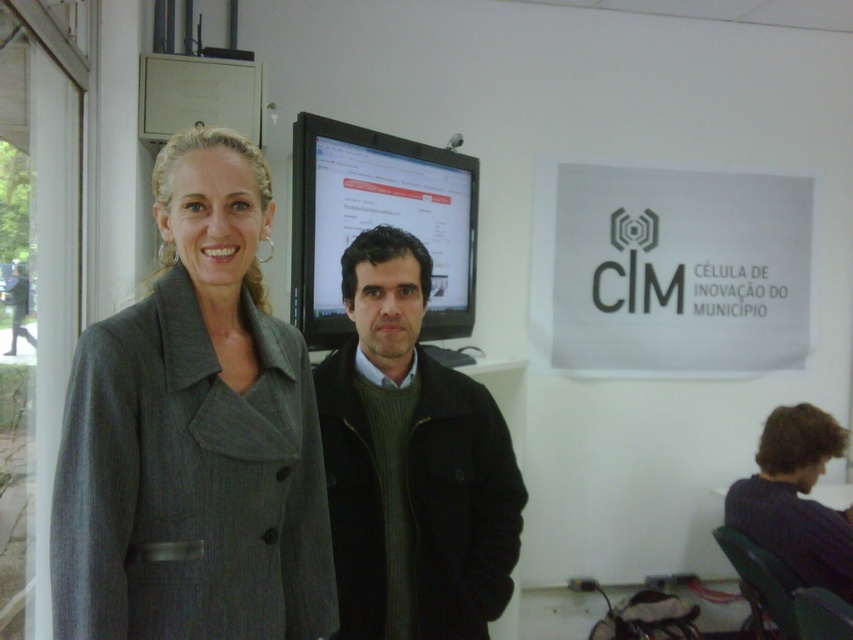
Between gray woolen coat at center and matte black monitor at center, which one appears on the left side from the viewer's perspective?

gray woolen coat at center is more to the left.

Between gray woolen coat at center and matte black monitor at center, which one is positioned lower?

gray woolen coat at center is below.

Who is more forward, (x=195, y=209) or (x=291, y=156)?

Point (x=195, y=209) is more forward.

The image size is (853, 640). Find the location of `gray woolen coat at center`. gray woolen coat at center is located at coordinates (194, 435).

Can you confirm if dark green sweater at center is wider than matte black monitor at center?

Incorrect, dark green sweater at center's width does not surpass matte black monitor at center's.

How far apart are dark green sweater at center and matte black monitor at center?

The distance of dark green sweater at center from matte black monitor at center is 31.81 inches.

Which is behind, point (390, 548) or point (463, 186)?

The point (463, 186) is more distant.

At what (x,y) coordinates should I click in order to perform the action: click on dark green sweater at center. Please return your answer as a coordinate pair (x, y). This screenshot has width=853, height=640. Looking at the image, I should click on (410, 464).

In the scene shown: Between gray woolen coat at center and dark green sweater at center, which one appears on the right side from the viewer's perspective?

From the viewer's perspective, dark green sweater at center appears more on the right side.

Is gray woolen coat at center in front of dark green sweater at center?

Yes.

The height and width of the screenshot is (640, 853). Describe the element at coordinates (194, 435) in the screenshot. I see `gray woolen coat at center` at that location.

At what (x,y) coordinates should I click in order to perform the action: click on gray woolen coat at center. Please return your answer as a coordinate pair (x, y). The height and width of the screenshot is (640, 853). Looking at the image, I should click on (194, 435).